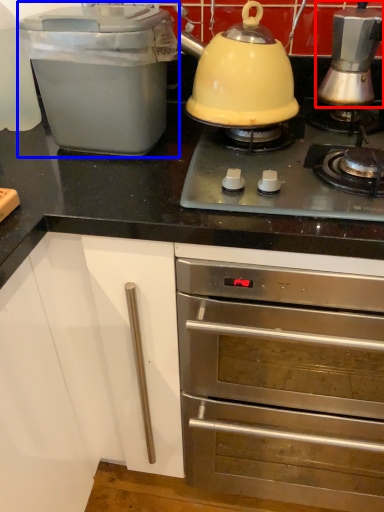
Question: Which of the following is the farthest to the observer, kitchen appliance (highlighted by a red box) or kitchen appliance (highlighted by a blue box)?

Choices:
 (A) kitchen appliance
 (B) kitchen appliance

Answer: (A)